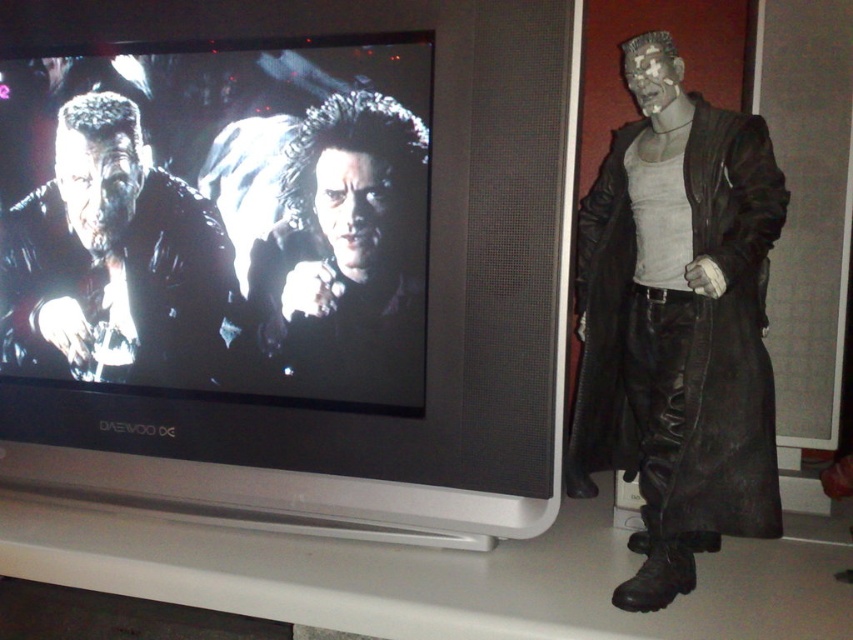
You are a costume designer working on a movie set. You need to determine which object in the scene is larger for a scene setup. Which is larger between the matte black coat at right and the shiny black hair at center?

The matte black coat at right is bigger than the shiny black hair at center.

You are a costume designer preparing for a play. You need to decide which item to place in the foreground for a dramatic effect. Which object should you choose between the matte black coat at right and the shiny black hair at center to ensure it stands out more visually?

The shiny black hair at center is thicker than the matte black coat at right, so it would stand out more visually and should be placed in the foreground.